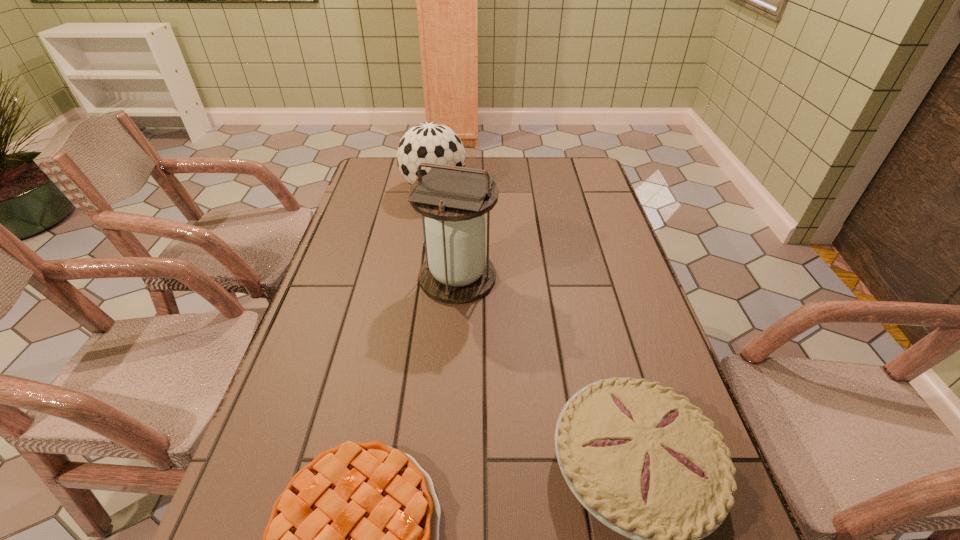
Where is `vacant space at the left edge of the desktop`? vacant space at the left edge of the desktop is located at coordinates (286, 445).

Find the location of a particular element. The height and width of the screenshot is (540, 960). vacant space at the right edge of the desktop is located at coordinates (572, 268).

What are the coordinates of `vacant point at the far left corner` in the screenshot? It's located at (369, 179).

I want to click on object that is the nearest to the farthest object, so click(453, 199).

Select which object is the second closest to the shortest object. Please provide its 2D coordinates. Your answer should be formatted as a tuple, i.e. [(x, y)], where the tuple contains the x and y coordinates of a point satisfying the conditions above.

[(453, 199)]